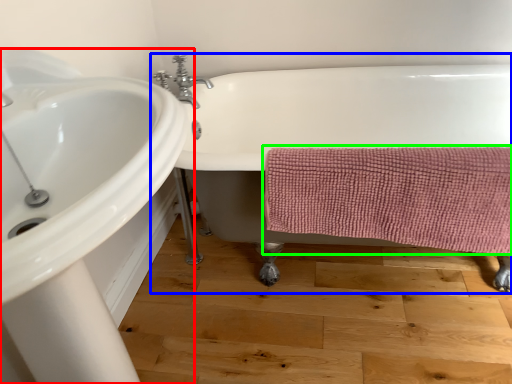
Question: Which is nearer to the sink (highlighted by a red box)? bathtub (highlighted by a blue box) or bath towel (highlighted by a green box).

Choices:
 (A) bathtub
 (B) bath towel

Answer: (B)